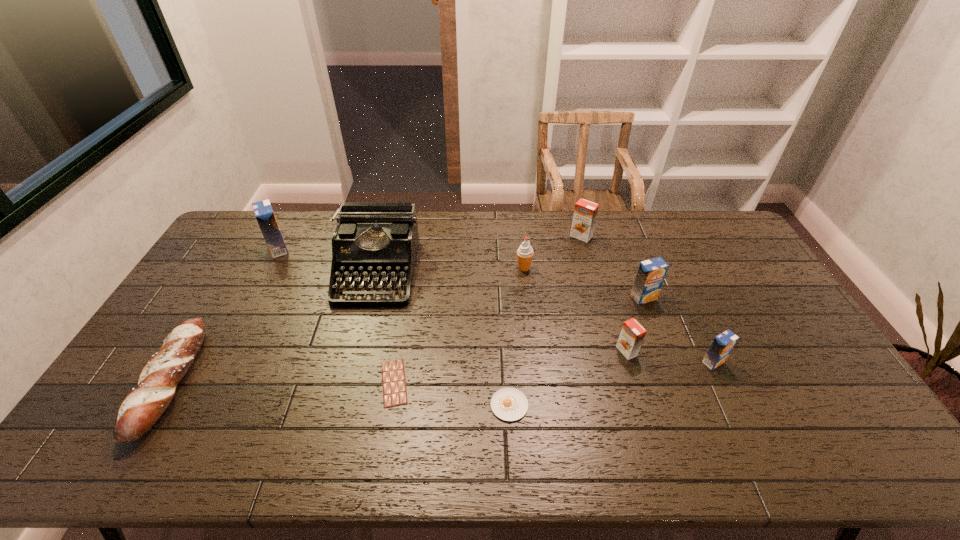
Where is `the leftmost orange juice`? the leftmost orange juice is located at coordinates (263, 211).

The image size is (960, 540). I want to click on the leftmost blue orange_juice, so click(263, 211).

Where is `black typewriter`? The image size is (960, 540). black typewriter is located at coordinates (375, 241).

Locate an element on the screen. The width and height of the screenshot is (960, 540). the bigger orange orange juice is located at coordinates point(585,212).

Identify the location of the fourth orange juice from left to right. (651, 273).

Locate an element on the screen. the second blue orange_juice from left to right is located at coordinates (651, 273).

I want to click on red icecream, so click(x=525, y=253).

I want to click on the smallest blue orange_juice, so click(722, 345).

Locate an element on the screen. The image size is (960, 540). the rightmost orange juice is located at coordinates 722,345.

Find the location of a particular element. Image resolution: width=960 pixels, height=540 pixels. the smaller orange orange juice is located at coordinates (632, 334).